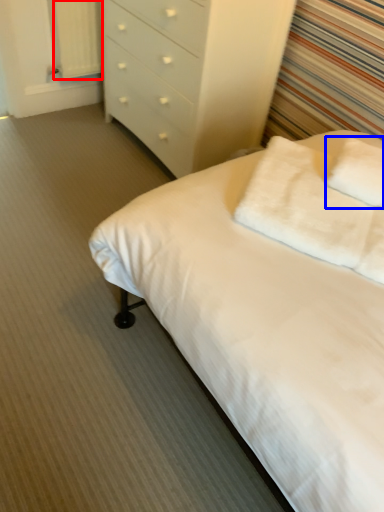
Question: Which object is closer to the camera taking this photo, curtain (highlighted by a red box) or pillow (highlighted by a blue box)?

Choices:
 (A) curtain
 (B) pillow

Answer: (B)